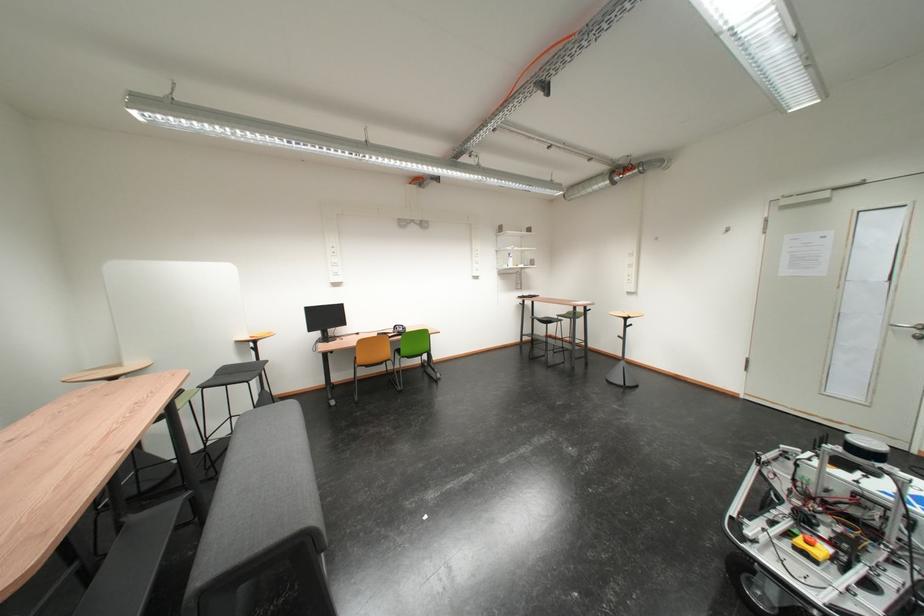
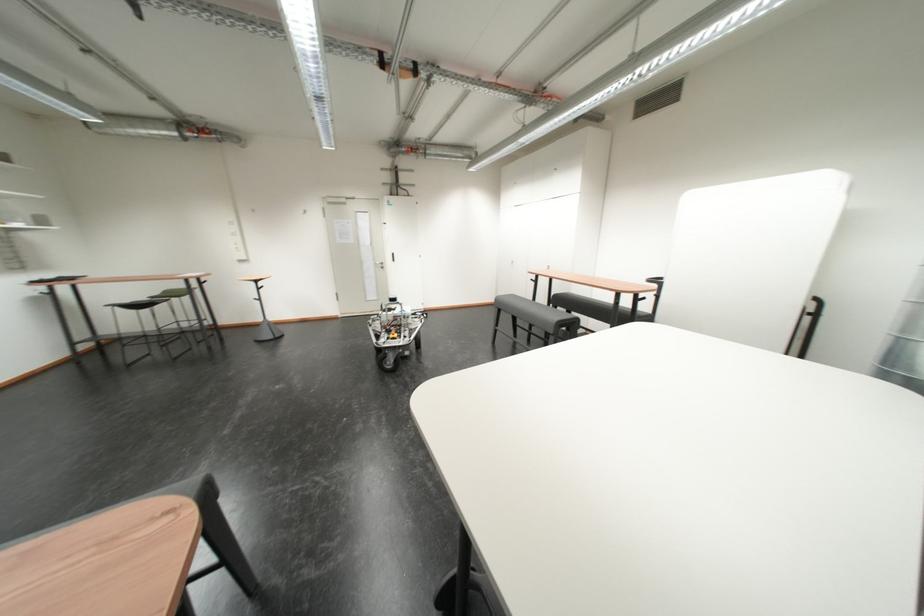
Locate, in the second image, the point that corresponds to point (533, 448) in the first image.

(246, 416)